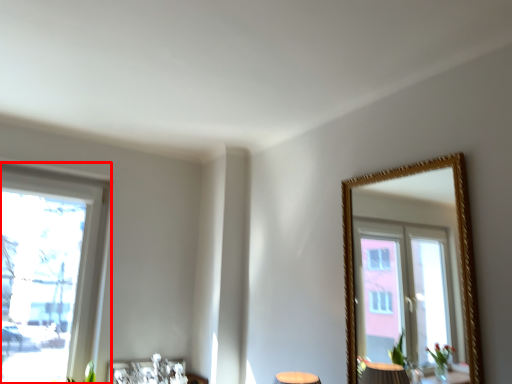
Question: From the image's perspective, what is the correct spatial relationship of window (annotated by the red box) in relation to picture frame?

Choices:
 (A) below
 (B) above

Answer: (B)